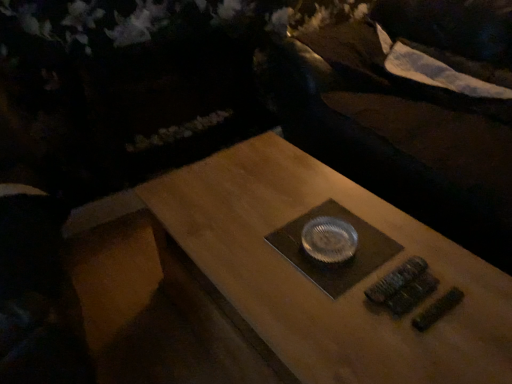
Question: Should I look upward or downward to see wooden table at center?

Choices:
 (A) down
 (B) up

Answer: (A)